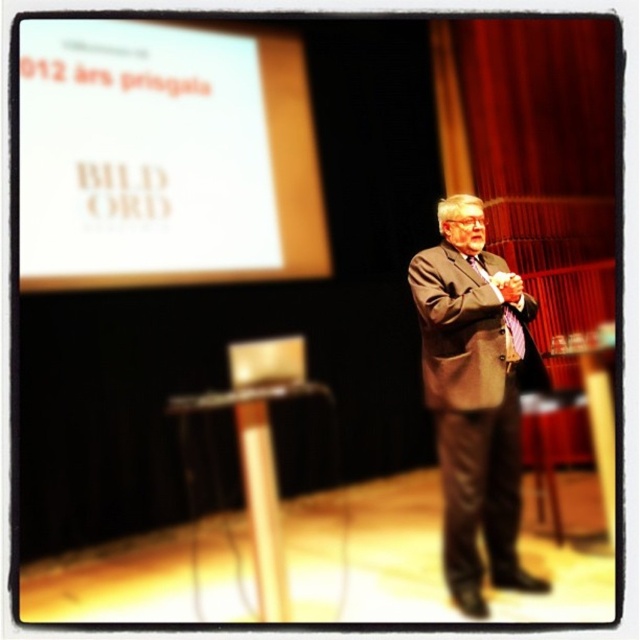
From the picture: You are an audience member sitting in the front row of the stage. You notice two items in the scene that are important for the presentation. The first is the white paper at upper left, and the second is the brown suit at center. Which of these two items is larger in size?

The white paper at upper left is bigger than the brown suit at center.

You are an attendee at the presentation. You notice the white paper at upper left and the brown suit at center. Which object is shorter in height?

The white paper at upper left has a lesser height compared to the brown suit at center, so the white paper at upper left is shorter in height.